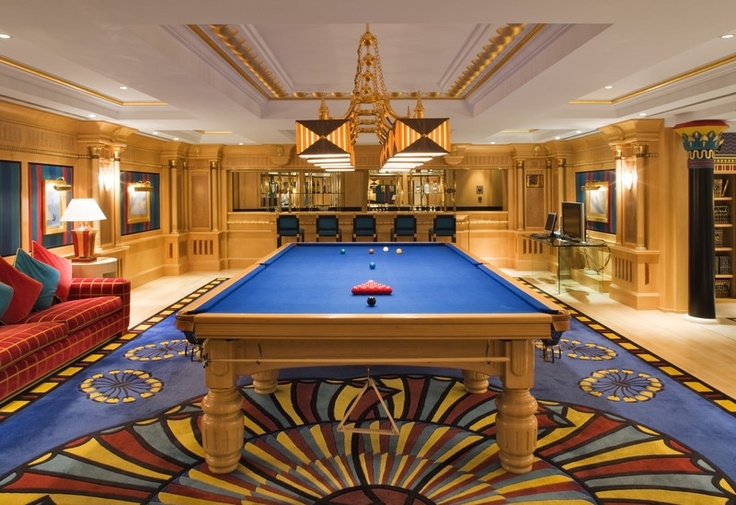
Locate an element on the screen. This screenshot has height=505, width=736. pool table is located at coordinates (428, 285).